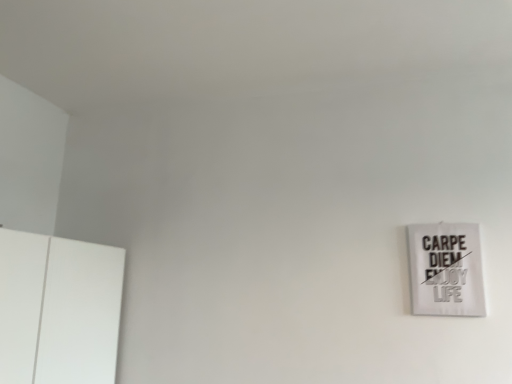
Describe the element at coordinates (445, 269) in the screenshot. I see `white paper poster at right` at that location.

Image resolution: width=512 pixels, height=384 pixels. Find the location of `white paper poster at right`. white paper poster at right is located at coordinates (445, 269).

Locate an element on the screen. Image resolution: width=512 pixels, height=384 pixels. white paper poster at right is located at coordinates (445, 269).